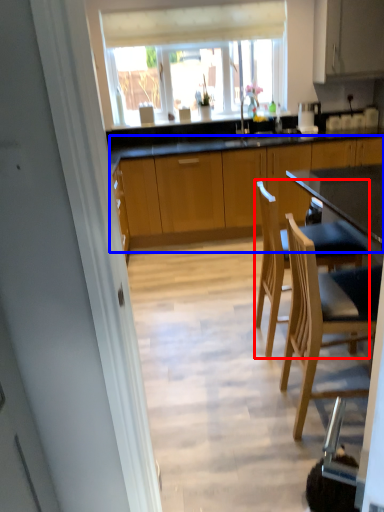
Question: Which object is further to the camera taking this photo, chair (highlighted by a red box) or cabinetry (highlighted by a blue box)?

Choices:
 (A) chair
 (B) cabinetry

Answer: (B)